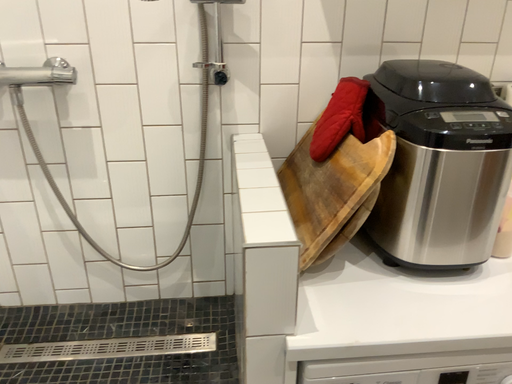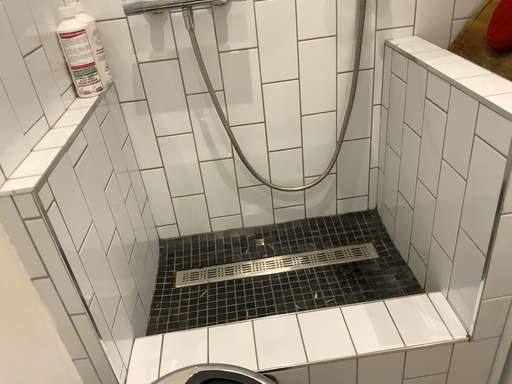
Question: How did the camera likely rotate when shooting the video?

Choices:
 (A) rotated downward
 (B) rotated upward

Answer: (A)